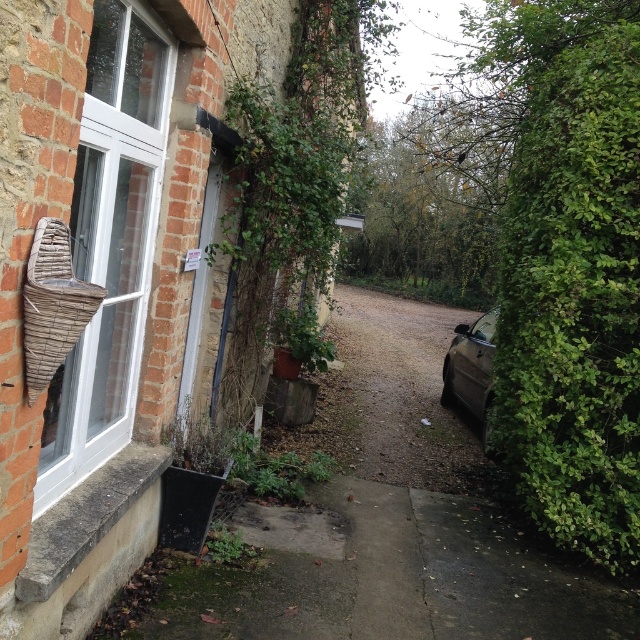
Is metallic gray car at right behind green matte plant at center?

Yes, it is.

Measure the distance between metallic gray car at right and camera.

They are 5.55 meters apart.

Between point (467, 403) and point (296, 362), which one is positioned in front?

Point (296, 362) is more forward.

Where is `metallic gray car at right`? This screenshot has width=640, height=640. metallic gray car at right is located at coordinates (472, 372).

Is brown gravel driveway at center below metallic gray car at right?

Actually, brown gravel driveway at center is above metallic gray car at right.

Does brown gravel driveway at center have a greater width compared to metallic gray car at right?

Yes.

What are the coordinates of `brown gravel driveway at center` in the screenshot? It's located at (396, 396).

Identify the location of brown gravel driveway at center. (396, 396).

Can you confirm if metallic gray car at right is shorter than green leafy plant at center?

No, metallic gray car at right is not shorter than green leafy plant at center.

Can you confirm if metallic gray car at right is wider than green leafy plant at center?

Correct, the width of metallic gray car at right exceeds that of green leafy plant at center.

Does point (483, 356) come in front of point (236, 547)?

No, (483, 356) is behind (236, 547).

Where is `metallic gray car at right`? The width and height of the screenshot is (640, 640). metallic gray car at right is located at coordinates (472, 372).